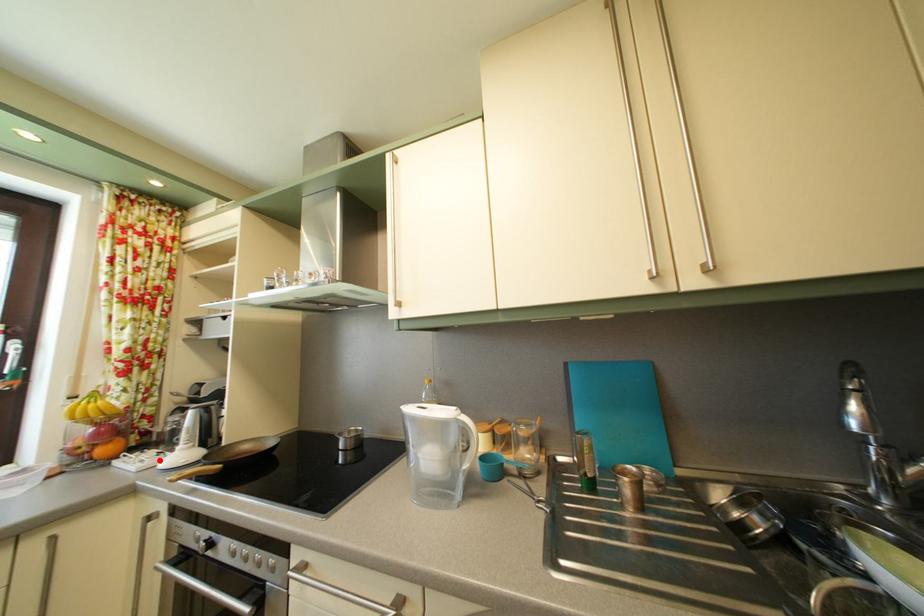
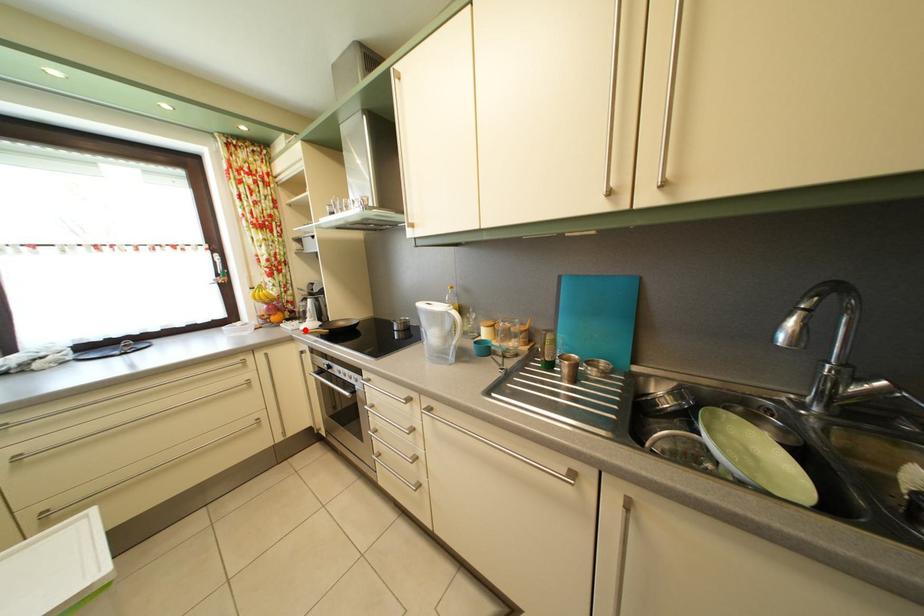
I am providing you with two images of the same scene from different viewpoints. A red point is marked on the first image and another point is marked on the second image. Are the points marked in image1 and image2 representing the same 3D position?

Yes